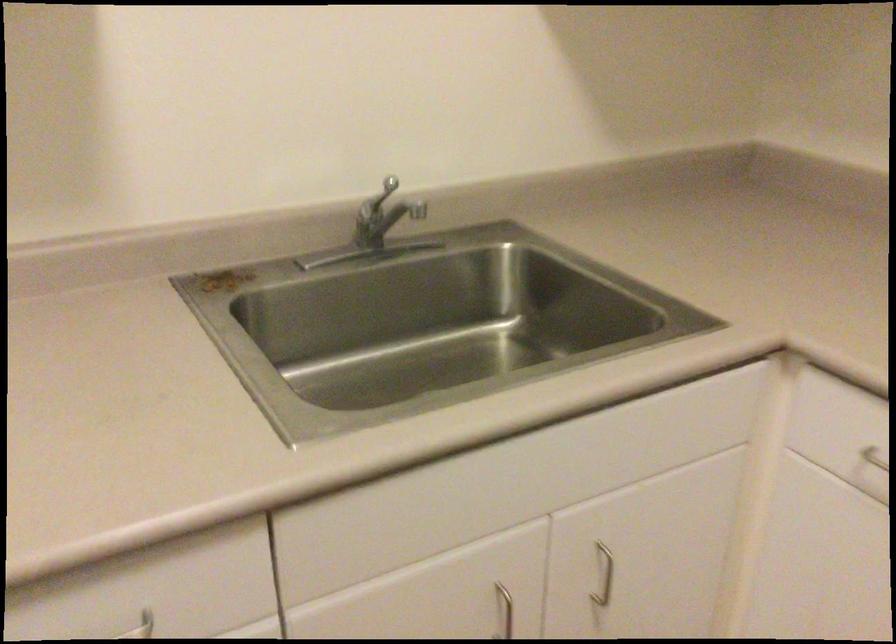
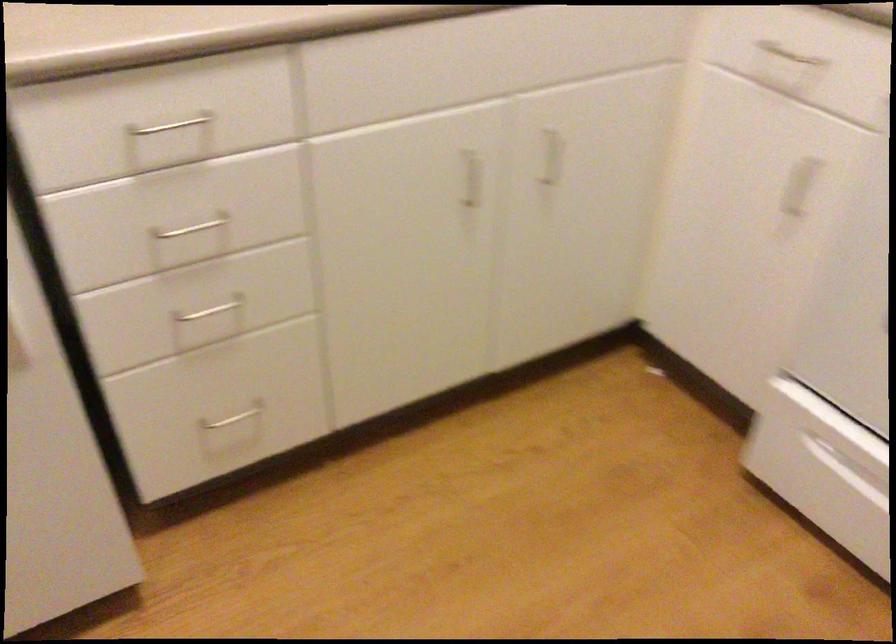
Question: The images are taken continuously from a first-person perspective. In which direction is your viewpoint rotating?

Choices:
 (A) Left
 (B) Right
 (C) Up
 (D) Down

Answer: (D)